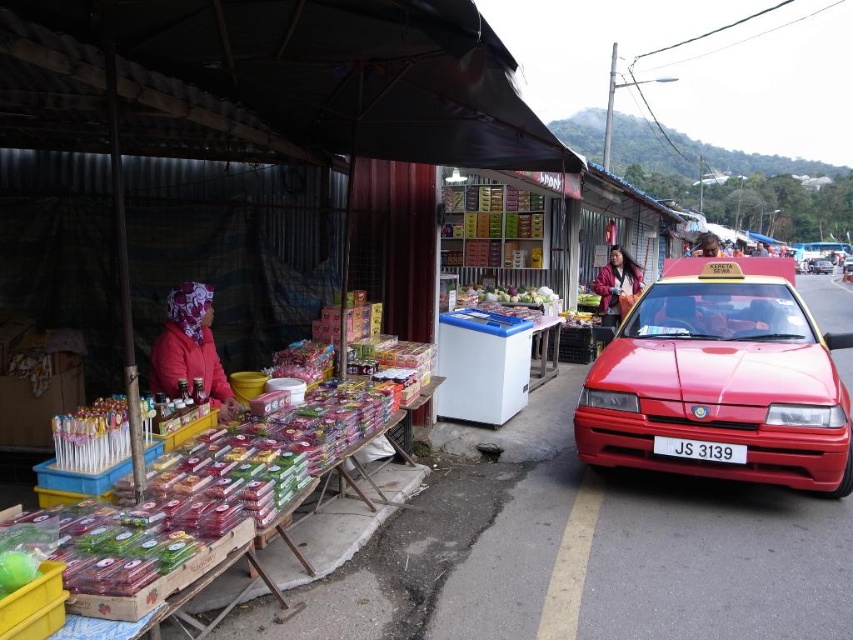
You are a driver who needs to park your car in a tight space. You see a white plastic license plate at center and a red matte taxi at right. Which object is smaller and therefore easier to maneuver around?

The white plastic license plate at center is smaller than the red matte taxi at right, so it would be easier to maneuver around the white plastic license plate at center.

You are a customer at the market and want to find the white plastic license plate at center. Which direction should you look relative to the leather jacket at upper right?

The white plastic license plate at center is to the left of the leather jacket at upper right.